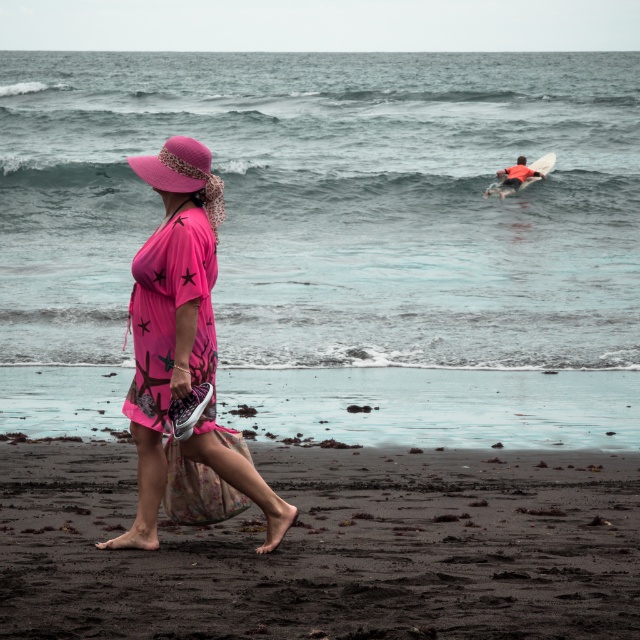
You are a photographer trying to capture the woman in the scene. You want to ensure both the pink fabric hat at left and the orange foam surfboard at upper right are visible in your shot. Based on their sizes, which object should you focus on to include both in the frame?

The pink fabric hat at left is not as tall as the orange foam surfboard at upper right, so focusing on the taller orange foam surfboard at upper right would allow both objects to be in the frame.

You are standing at the beach and see two points marked in the image. The first point is at coordinates point (170,148) and the second is at point (520,156). Which point is closer to you?

Point (170,148) is closer to the camera than point (520,156).